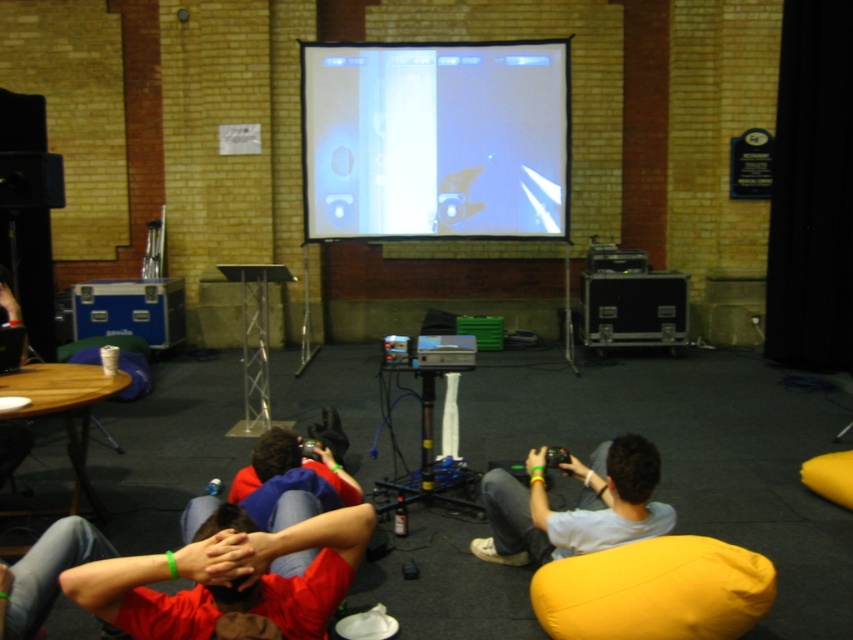
Question: Which point is farther to the camera?

Choices:
 (A) yellow fabric bean bag at lower right
 (B) red fabric shirt at center

Answer: (A)

Question: Can you confirm if red fabric shirt at center is wider than light gray fabric shirt at center?

Choices:
 (A) no
 (B) yes

Answer: (B)

Question: Which point is closer to the camera taking this photo?

Choices:
 (A) click(173, 616)
 (B) click(614, 525)

Answer: (A)

Question: Is white glossy projection screen at upper center below light gray fabric shirt at center?

Choices:
 (A) yes
 (B) no

Answer: (B)

Question: Considering the relative positions of white glossy projection screen at upper center and light gray fabric shirt at center in the image provided, where is white glossy projection screen at upper center located with respect to light gray fabric shirt at center?

Choices:
 (A) right
 (B) left

Answer: (B)

Question: Which of the following is the farthest from the observer?

Choices:
 (A) yellow fabric bean bag at lower right
 (B) white glossy projection screen at upper center
 (C) light gray fabric shirt at center
 (D) red fabric shirt at center

Answer: (B)